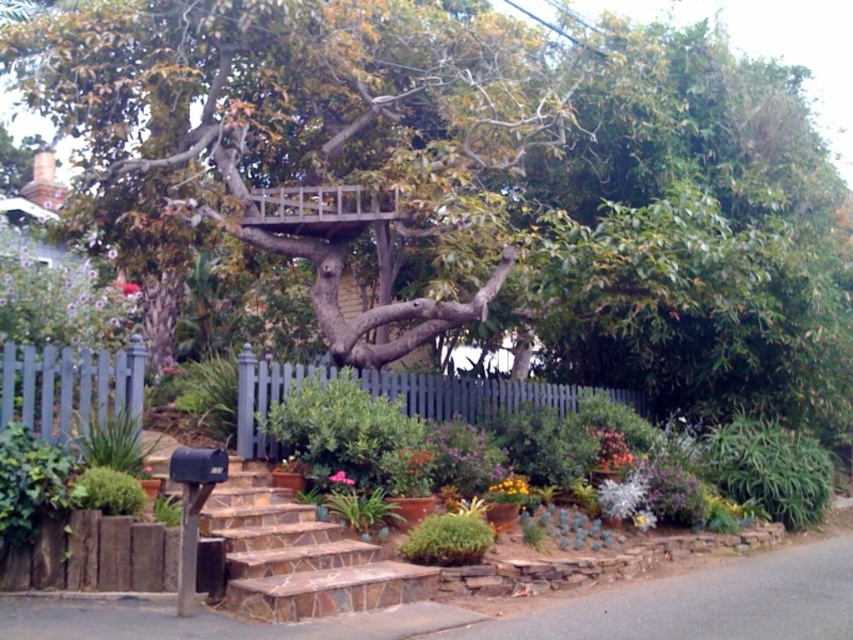
Question: Is blue picket fence at left to the left of pink matte flower at center from the viewer's perspective?

Choices:
 (A) no
 (B) yes

Answer: (B)

Question: Among these objects, which one is farthest from the camera?

Choices:
 (A) blue picket fence at left
 (B) brown wooden treehouse at upper center
 (C) gray wood fence at center

Answer: (C)

Question: Is yellow matte flower at center positioned in front of pink matte flower at center?

Choices:
 (A) yes
 (B) no

Answer: (B)

Question: Is brown wooden treehouse at upper center thinner than yellow matte flower at center?

Choices:
 (A) yes
 (B) no

Answer: (B)

Question: Which object is closer to the camera taking this photo?

Choices:
 (A) blue picket fence at left
 (B) pink matte flower at center
 (C) yellow matte flower at center

Answer: (A)

Question: Which point is farther to the camera?

Choices:
 (A) yellow matte flower at center
 (B) gray wood fence at center

Answer: (B)